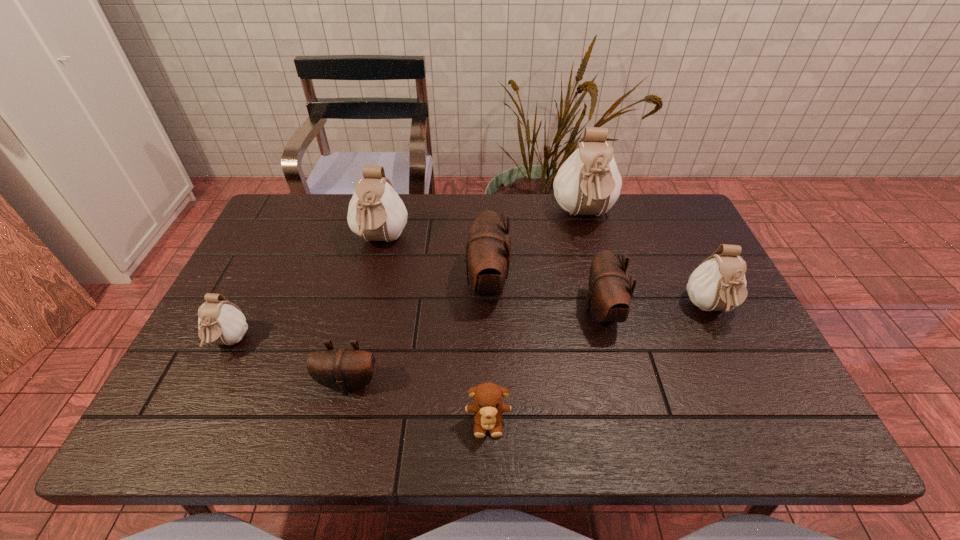
Find the location of a particular element. free space at the left edge is located at coordinates (251, 373).

Locate an element on the screen. vacant space at the right edge is located at coordinates (741, 362).

You are a GUI agent. You are given a task and a screenshot of the screen. Output one action in this format:
    pyautogui.click(x=<x>, y=<y>)
    Task: Click on the free location at the far left corner
    
    Given the screenshot: What is the action you would take?
    pyautogui.click(x=302, y=201)

Locate an element on the screen. vacant area that lies between the second white pouch from left to right and the brown teddy bear is located at coordinates click(x=434, y=332).

In order to click on empty space between the third white pouch from right to left and the biggest brown pouch in this screenshot , I will do `click(434, 262)`.

Where is `free space between the biggest brown pouch and the leftmost pouch`? Image resolution: width=960 pixels, height=540 pixels. free space between the biggest brown pouch and the leftmost pouch is located at coordinates (358, 313).

You are a GUI agent. You are given a task and a screenshot of the screen. Output one action in this format:
    pyautogui.click(x=<x>, y=<y>)
    Task: Click on the free spot between the fourth pouch from right to left and the second smallest brown pouch
    Image resolution: width=960 pixels, height=540 pixels.
    Given the screenshot: What is the action you would take?
    pyautogui.click(x=544, y=297)

The height and width of the screenshot is (540, 960). Identify the location of vacant area between the second brown pouch from left to right and the rightmost brown pouch. (544, 297).

Where is `vacant region between the second brown pouch from left to right and the second biggest brown pouch`? vacant region between the second brown pouch from left to right and the second biggest brown pouch is located at coordinates (544, 297).

The width and height of the screenshot is (960, 540). I want to click on free spot between the nearest object and the fourth pouch from right to left, so click(x=488, y=353).